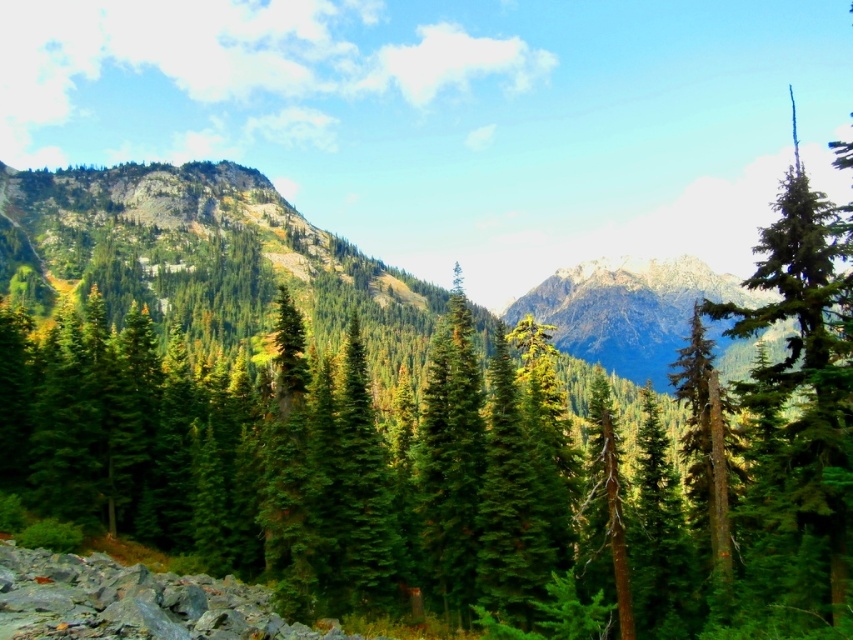
You are an adventurer standing in the forest and want to reach the green forested mountain at center. Which direction should you head towards relative to the green matte tree at right?

You should head to the left relative to the green matte tree at right because the green forested mountain at center is located to the left of the green matte tree at right.

You are standing in the forest and want to reach the two points marked in the image. Which point, point (769, 572) or point (677, 282), is closer to you?

Point (769, 572) is closer to the viewer than point (677, 282).